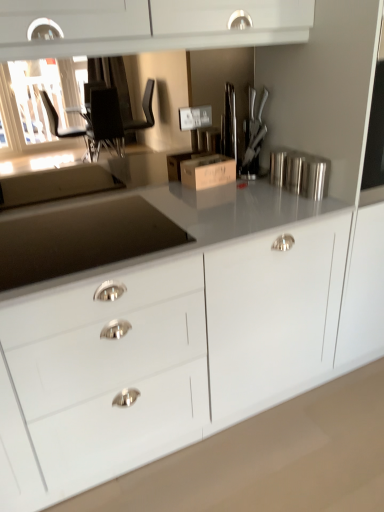
Question: Is the position of silver metallic canister at upper right more distant than that of brown cardboard box at center?

Choices:
 (A) no
 (B) yes

Answer: (A)

Question: Would you say silver metallic canister at upper right is a long distance from brown cardboard box at center?

Choices:
 (A) no
 (B) yes

Answer: (A)

Question: Does silver metallic canister at upper right have a lesser height compared to brown cardboard box at center?

Choices:
 (A) yes
 (B) no

Answer: (B)

Question: Is silver metallic canister at upper right closer to camera compared to brown cardboard box at center?

Choices:
 (A) no
 (B) yes

Answer: (B)

Question: Is silver metallic canister at upper right at the left side of brown cardboard box at center?

Choices:
 (A) yes
 (B) no

Answer: (B)

Question: Is silver metallic canister at upper right oriented towards brown cardboard box at center?

Choices:
 (A) no
 (B) yes

Answer: (A)

Question: Are brown cardboard box at center and silver metallic canister at upper right beside each other?

Choices:
 (A) no
 (B) yes

Answer: (A)

Question: Can you confirm if brown cardboard box at center is positioned to the right of silver metallic canister at upper right?

Choices:
 (A) yes
 (B) no

Answer: (B)

Question: Considering the relative positions of brown cardboard box at center and silver metallic canister at upper right in the image provided, is brown cardboard box at center to the left of silver metallic canister at upper right from the viewer's perspective?

Choices:
 (A) no
 (B) yes

Answer: (B)

Question: Is brown cardboard box at center wider than silver metallic canister at upper right?

Choices:
 (A) no
 (B) yes

Answer: (B)

Question: Is brown cardboard box at center surrounding silver metallic canister at upper right?

Choices:
 (A) yes
 (B) no

Answer: (B)

Question: From a real-world perspective, is brown cardboard box at center below silver metallic canister at upper right?

Choices:
 (A) no
 (B) yes

Answer: (B)

Question: From the image's perspective, relative to brown cardboard box at center, is silver metallic canister at upper right above or below?

Choices:
 (A) below
 (B) above

Answer: (A)